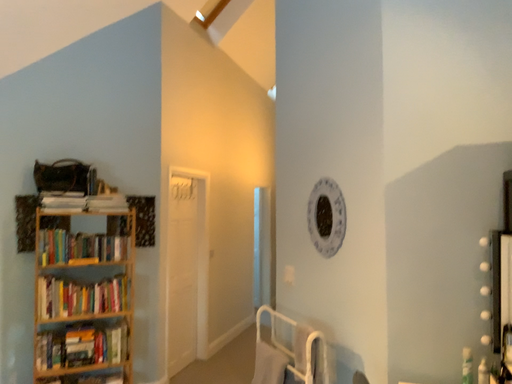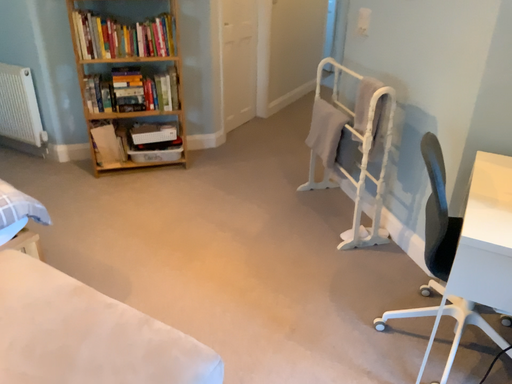
Question: How did the camera likely rotate when shooting the video?

Choices:
 (A) rotated upward
 (B) rotated downward

Answer: (B)